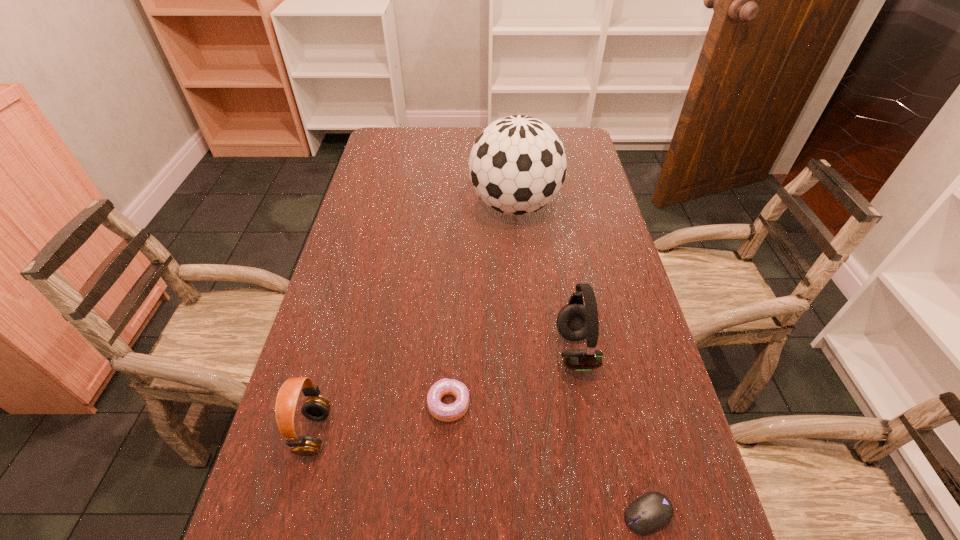
The image size is (960, 540). In order to click on vacant region between the computer mouse and the third tallest object in this screenshot , I will do `click(481, 474)`.

Locate an element on the screen. This screenshot has height=540, width=960. vacant region between the shortest object and the doughnut is located at coordinates coord(548,459).

You are a GUI agent. You are given a task and a screenshot of the screen. Output one action in this format:
    pyautogui.click(x=<x>, y=<y>)
    Task: Click on the vacant area that lies between the fourth tallest object and the shorter headset
    The height and width of the screenshot is (540, 960).
    Given the screenshot: What is the action you would take?
    pyautogui.click(x=382, y=418)

Identify which object is located as the fourth nearest to the nearest object. Please provide its 2D coordinates. Your answer should be formatted as a tuple, i.e. [(x, y)], where the tuple contains the x and y coordinates of a point satisfying the conditions above.

[(517, 165)]

Locate which object is the second closest to the tallest object. Please provide its 2D coordinates. Your answer should be formatted as a tuple, i.e. [(x, y)], where the tuple contains the x and y coordinates of a point satisfying the conditions above.

[(447, 413)]

The width and height of the screenshot is (960, 540). Find the location of `free location that satisfies the following two spatial constraints: 1. on the back side of the tallest object; 2. on the left side of the doughnut`. free location that satisfies the following two spatial constraints: 1. on the back side of the tallest object; 2. on the left side of the doughnut is located at coordinates pyautogui.click(x=459, y=206).

Locate an element on the screen. This screenshot has width=960, height=540. vacant space that satisfies the following two spatial constraints: 1. on the ear cups of the taller headset; 2. on the right side of the shortest object is located at coordinates (605, 514).

Find the location of a particular element. Image resolution: width=960 pixels, height=540 pixels. vacant space that satisfies the following two spatial constraints: 1. on the front side of the doughnut; 2. on the ear cups of the nearer headset is located at coordinates (447, 433).

Identify the location of vacant region that satisfies the following two spatial constraints: 1. on the ear cups of the nearest object; 2. on the right side of the taller headset. (605, 514).